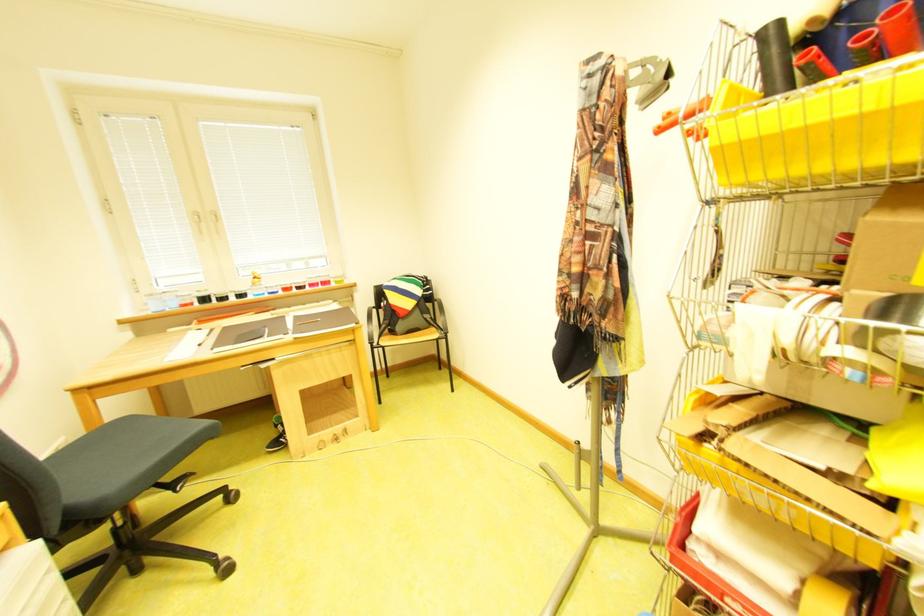
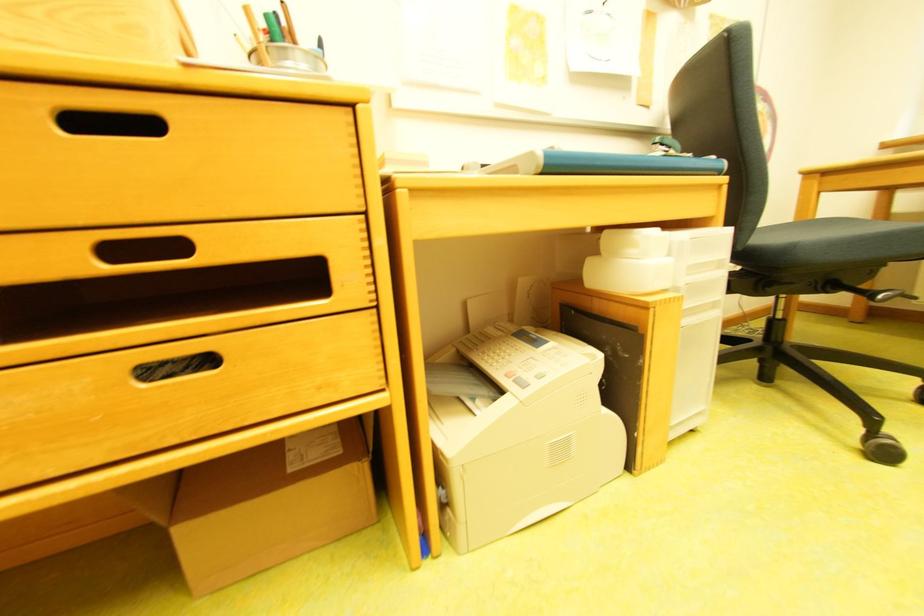
The images are taken continuously from a first-person perspective. In which direction is your viewpoint rotating?

The camera's rotation is toward left-down.